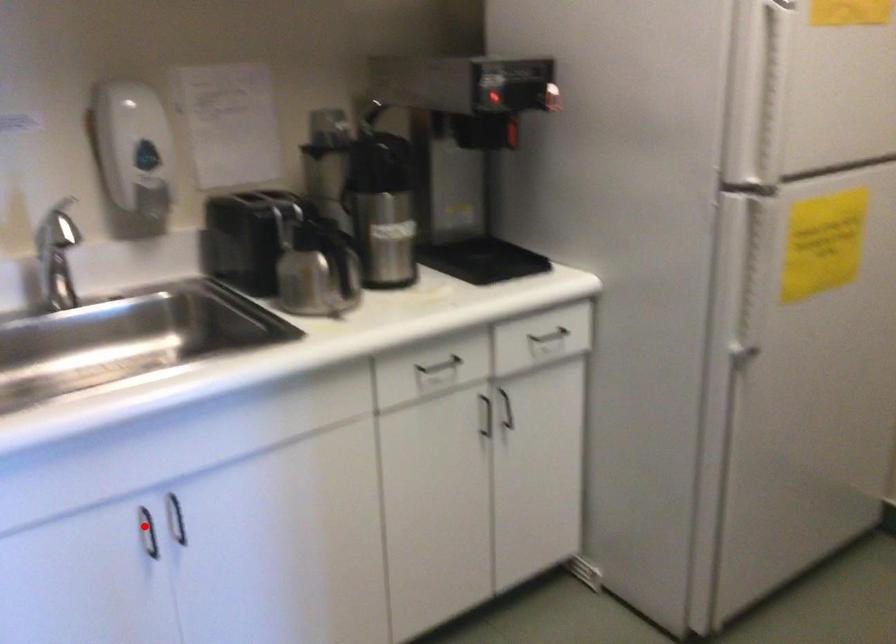
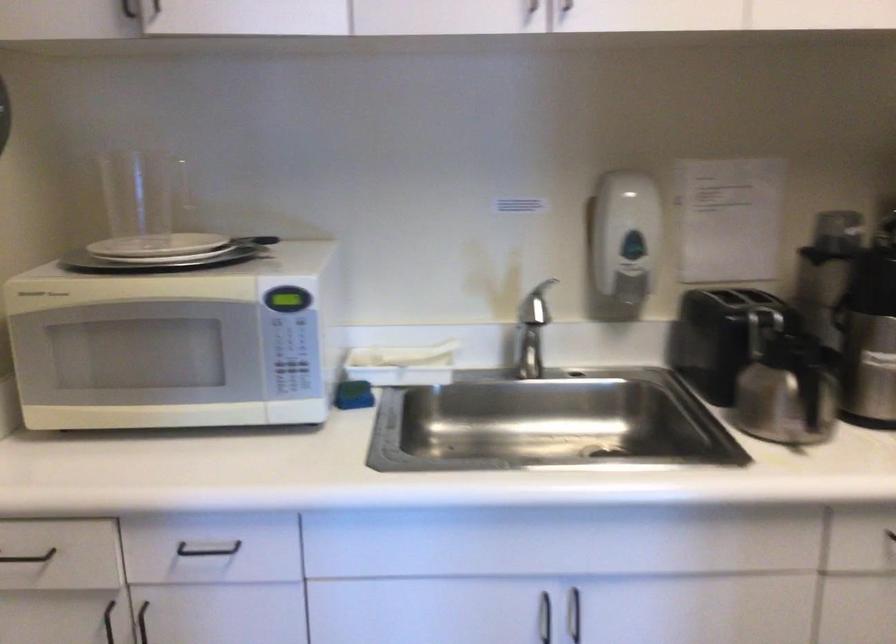
In the second image, find the point that corresponds to the highlighted location in the first image.

(544, 618)